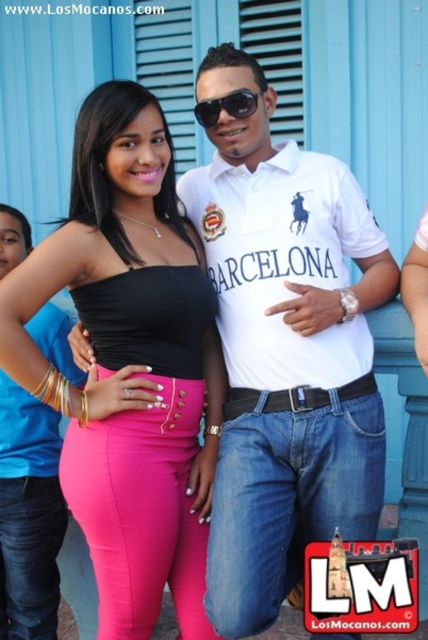
Question: Which point is farther from the camera taking this photo?

Choices:
 (A) click(189, 568)
 (B) click(30, 497)
 (C) click(302, 524)

Answer: (B)

Question: Observing the image, what is the correct spatial positioning of white cotton shirt at center in reference to matte black top at center?

Choices:
 (A) above
 (B) below

Answer: (A)

Question: Estimate the real-world distances between objects in this image. Which object is farther from the matte black top at center?

Choices:
 (A) pink matte pants at lower center
 (B) sunglasses at center
 (C) pink matte leggings at center
 (D) pink matte leggings at lower left

Answer: (B)

Question: Can you confirm if matte black top at center is bigger than pink matte leggings at lower left?

Choices:
 (A) yes
 (B) no

Answer: (A)

Question: Based on their relative distances, which object is nearer to the pink matte pants at lower center?

Choices:
 (A) white cotton shirt at center
 (B) pink matte leggings at center

Answer: (B)

Question: Does pink matte leggings at lower left have a lesser width compared to sunglasses at center?

Choices:
 (A) yes
 (B) no

Answer: (B)